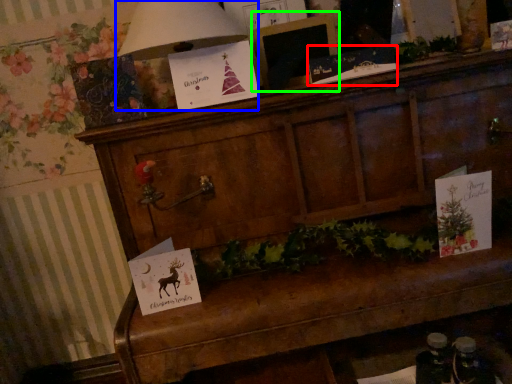
Question: Which is farther away from christmas card (highlighted by a red box)? lamp (highlighted by a blue box) or picture frame (highlighted by a green box)?

Choices:
 (A) lamp
 (B) picture frame

Answer: (A)